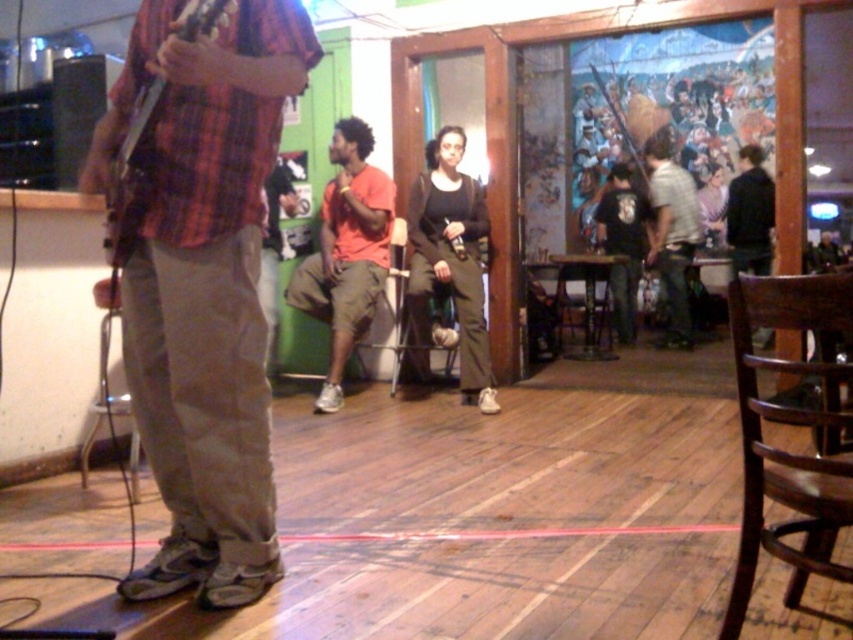
Is plaid fabric shirt at left wider than orange cotton shirt at center?

Indeed, plaid fabric shirt at left has a greater width compared to orange cotton shirt at center.

Can you confirm if plaid fabric shirt at left is thinner than orange cotton shirt at center?

Incorrect, plaid fabric shirt at left's width is not less than orange cotton shirt at center's.

Between point (212, 48) and point (337, 157), which one is positioned in front?

Point (212, 48)

Locate an element on the screen. Image resolution: width=853 pixels, height=640 pixels. plaid fabric shirt at left is located at coordinates pyautogui.click(x=202, y=284).

Is matte black shirt at center thinner than wooden acoustic guitar at left?

Incorrect, matte black shirt at center's width is not less than wooden acoustic guitar at left's.

Which is in front, point (486, 408) or point (161, 90)?

Point (161, 90) is more forward.

Identify the location of matte black shirt at center. [450, 260].

Between point (161, 120) and point (123, 145), which one is positioned behind?

The point (123, 145) is behind.

Does point (164, 339) come closer to viewer compared to point (207, 29)?

No, (164, 339) is further to viewer.

Is point (239, 516) positioned after point (131, 214)?

Yes, it is.

The width and height of the screenshot is (853, 640). What are the coordinates of `plaid fabric shirt at left` in the screenshot? It's located at (202, 284).